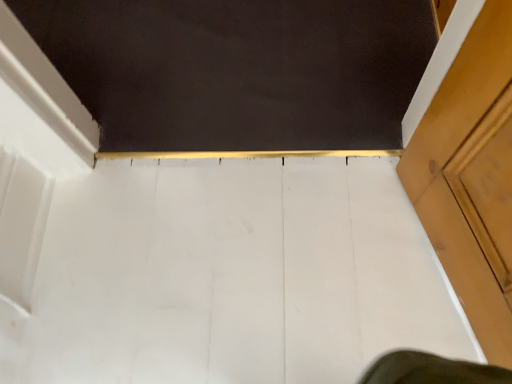
Locate an element on the screen. white matte stairs at center is located at coordinates (233, 276).

What do you see at coordinates (233, 276) in the screenshot? I see `white matte stairs at center` at bounding box center [233, 276].

Locate an element on the screen. The height and width of the screenshot is (384, 512). white matte stairs at center is located at coordinates (233, 276).